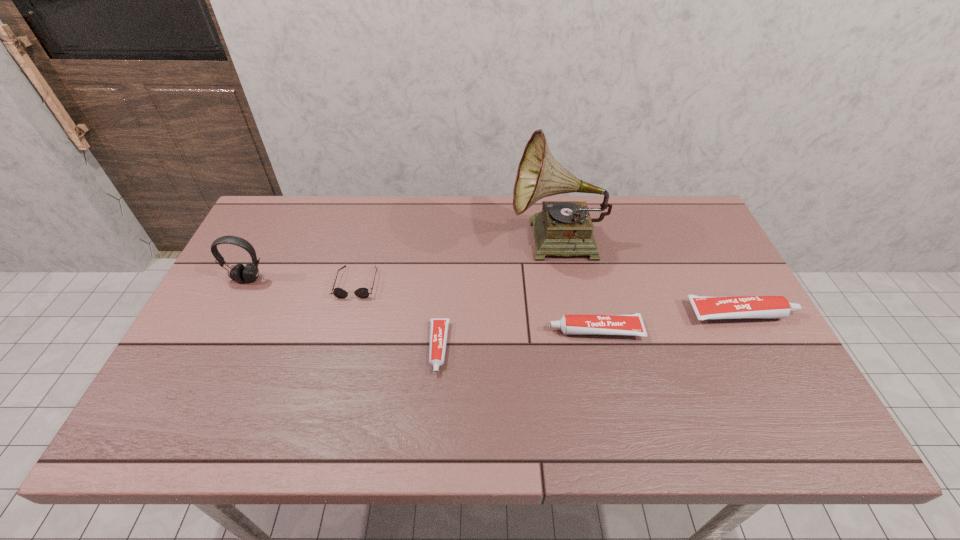
Identify which object is the second nearest to the second object from left to right. Please provide its 2D coordinates. Your answer should be formatted as a tuple, i.e. [(x, y)], where the tuple contains the x and y coordinates of a point satisfying the conditions above.

[(239, 273)]

Identify which toothpaste is located as the nearest to the shortest toothpaste. Please provide its 2D coordinates. Your answer should be formatted as a tuple, i.e. [(x, y)], where the tuple contains the x and y coordinates of a point satisfying the conditions above.

[(617, 324)]

This screenshot has width=960, height=540. I want to click on toothpaste object that ranks as the second closest to the sunglasses, so (617, 324).

Find the location of a particular element. free space that satisfies the following two spatial constraints: 1. from the horn of the tallest object; 2. at the nozzle of the leftmost toothpaste is located at coordinates (576, 348).

At what (x,y) coordinates should I click in order to perform the action: click on free space that satisfies the following two spatial constraints: 1. from the horn of the record player; 2. on the front-facing side of the sunglasses. Please return your answer as a coordinate pair (x, y). Looking at the image, I should click on (564, 282).